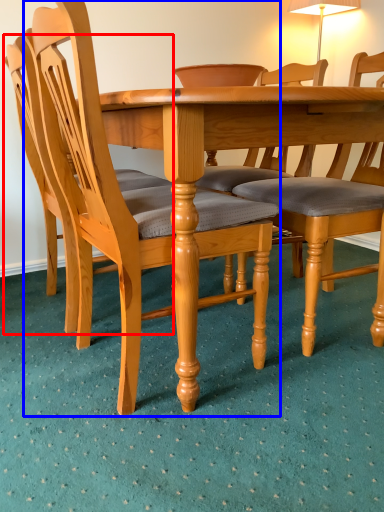
Question: Which of the following is the farthest to the observer, chair (highlighted by a red box) or chair (highlighted by a blue box)?

Choices:
 (A) chair
 (B) chair

Answer: (A)